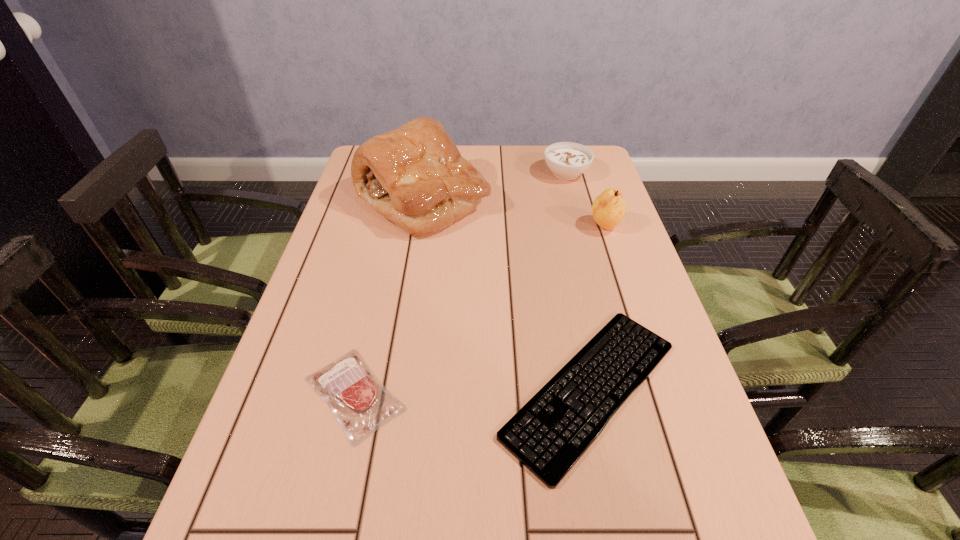
Find the location of `vacant space at the left edge`. vacant space at the left edge is located at coordinates (347, 353).

In the image, there is a desktop. At what (x,y) coordinates should I click in order to perform the action: click on free space at the right edge. Please return your answer as a coordinate pair (x, y). The width and height of the screenshot is (960, 540). Looking at the image, I should click on (676, 427).

What are the coordinates of `vacant point at the far right corner` in the screenshot? It's located at (556, 179).

The height and width of the screenshot is (540, 960). What are the coordinates of `vacant region between the computer keyboard and the steak` in the screenshot? It's located at (472, 392).

Locate an element on the screen. free space between the fourth tallest object and the shortest object is located at coordinates (472, 392).

Find the location of a particular element. The width and height of the screenshot is (960, 540). empty space between the steak and the shortest object is located at coordinates (472, 392).

At what (x,y) coordinates should I click in order to perform the action: click on unoccupied area between the shortest object and the tallest object. Please return your answer as a coordinate pair (x, y). This screenshot has height=540, width=960. Looking at the image, I should click on (507, 295).

The width and height of the screenshot is (960, 540). I want to click on vacant area that lies between the third shortest object and the pear, so click(586, 200).

I want to click on free point between the third shortest object and the computer keyboard, so click(x=578, y=281).

You are a GUI agent. You are given a task and a screenshot of the screen. Output one action in this format:
    pyautogui.click(x=<x>, y=<y>)
    Task: Click on the object that is the fourth closest to the pear
    This screenshot has width=960, height=540.
    Given the screenshot: What is the action you would take?
    pyautogui.click(x=361, y=403)